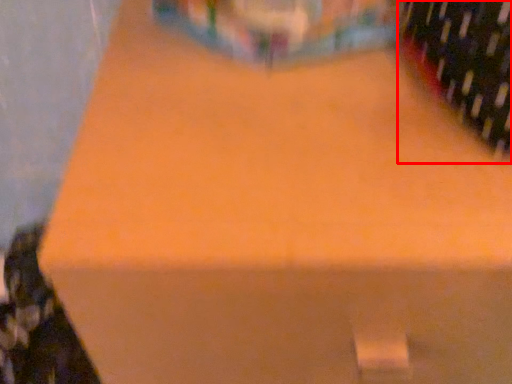
Question: From the image's perspective, what is the correct spatial relationship of wine bottle (annotated by the red box) in relation to wine bottle?

Choices:
 (A) above
 (B) below

Answer: (A)